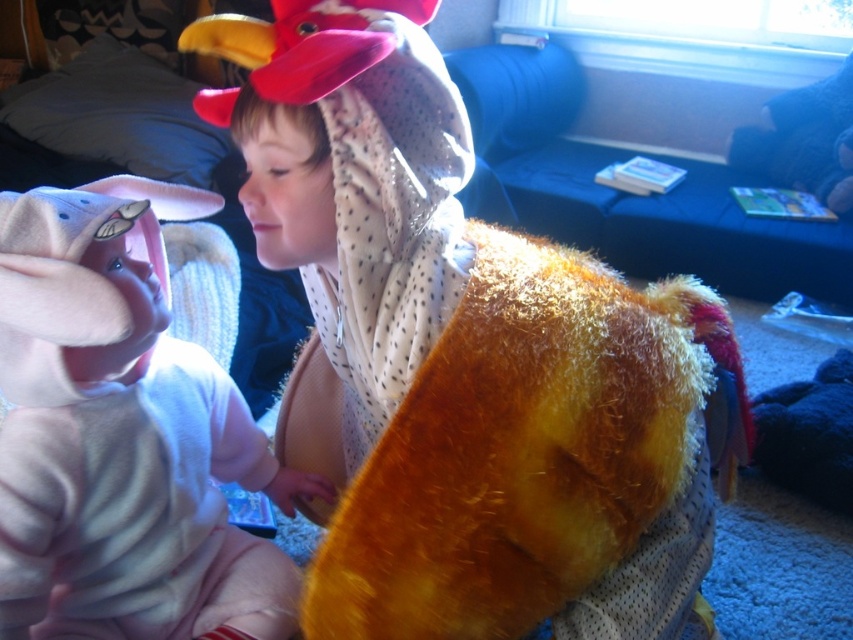
Question: Does fuzzy yellow costume at center appear on the left side of soft pink plush toy at left?

Choices:
 (A) yes
 (B) no

Answer: (B)

Question: Which object appears farthest from the camera in this image?

Choices:
 (A) fuzzy yellow costume at center
 (B) soft pink plush toy at left

Answer: (B)

Question: Can you confirm if fuzzy yellow costume at center is smaller than soft pink plush toy at left?

Choices:
 (A) no
 (B) yes

Answer: (A)

Question: Does fuzzy yellow costume at center have a larger size compared to soft pink plush toy at left?

Choices:
 (A) yes
 (B) no

Answer: (A)